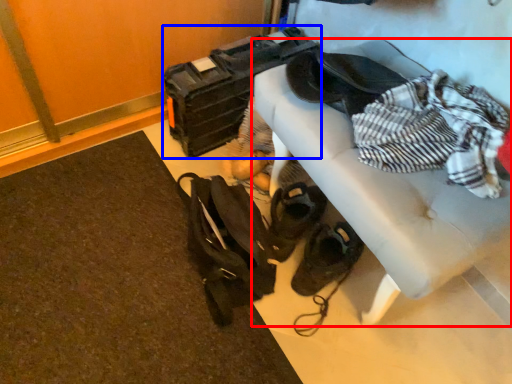
Question: Which object is closer to the camera taking this photo, furniture (highlighted by a red box) or luggage (highlighted by a blue box)?

Choices:
 (A) furniture
 (B) luggage

Answer: (A)